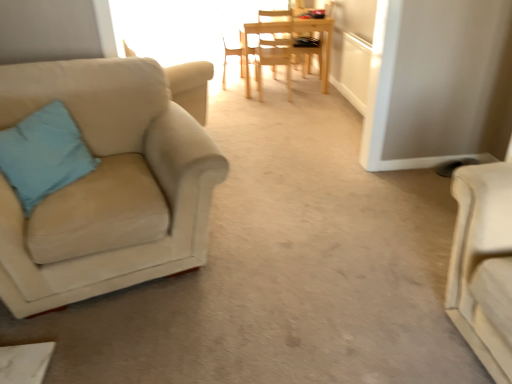
Question: Is light wood chair at center, acting as the 3th chair starting from the front, surrounded by wooden chair at center, the 1th chair in the back-to-front sequence?

Choices:
 (A) yes
 (B) no

Answer: (B)

Question: From the image's perspective, is wooden chair at center, the 1th chair in the back-to-front sequence, on top of light wood chair at center, the third chair in the back-to-front sequence?

Choices:
 (A) yes
 (B) no

Answer: (A)

Question: Is the depth of wooden chair at center, the 1th chair in the back-to-front sequence, greater than that of light wood chair at center, the third chair in the back-to-front sequence?

Choices:
 (A) no
 (B) yes

Answer: (B)

Question: Is wooden chair at center, the 5th chair viewed from the front, shorter than light wood chair at center, acting as the 3th chair starting from the front?

Choices:
 (A) yes
 (B) no

Answer: (B)

Question: Does wooden chair at center, the 5th chair viewed from the front, have a greater width compared to light wood chair at center, acting as the 3th chair starting from the front?

Choices:
 (A) no
 (B) yes

Answer: (A)

Question: Considering the positions of light wood chair at center, which is counted as the fourth chair, starting from the back, and light wood chair at center, acting as the 3th chair starting from the front, in the image, is light wood chair at center, which is counted as the fourth chair, starting from the back, wider or thinner than light wood chair at center, acting as the 3th chair starting from the front,?

Choices:
 (A) wide
 (B) thin

Answer: (B)

Question: In terms of height, does light wood chair at center, which is counted as the fourth chair, starting from the back, look taller or shorter compared to light wood chair at center, acting as the 3th chair starting from the front?

Choices:
 (A) tall
 (B) short

Answer: (A)

Question: Is light wood chair at center, the 2th chair in the front-to-back sequence, to the left or to the right of light wood chair at center, the third chair in the back-to-front sequence, in the image?

Choices:
 (A) right
 (B) left

Answer: (B)

Question: Is light wood chair at center, the 2th chair in the front-to-back sequence, bigger or smaller than light wood chair at center, acting as the 3th chair starting from the front?

Choices:
 (A) small
 (B) big

Answer: (A)

Question: From a real-world perspective, is wooden chair at center, which is the second chair in back-to-front order, physically located above or below blue fabric pillow at left?

Choices:
 (A) below
 (B) above

Answer: (A)

Question: From their relative heights in the image, would you say wooden chair at center, acting as the 4th chair starting from the front, is taller or shorter than blue fabric pillow at left?

Choices:
 (A) short
 (B) tall

Answer: (B)

Question: Would you say wooden chair at center, which is the second chair in back-to-front order, is to the left or to the right of blue fabric pillow at left in the picture?

Choices:
 (A) right
 (B) left

Answer: (A)

Question: Choose the correct answer: Is wooden chair at center, acting as the 4th chair starting from the front, inside blue fabric pillow at left or outside it?

Choices:
 (A) inside
 (B) outside

Answer: (B)

Question: From the image's perspective, relative to wooden chair at center, which is the second chair in back-to-front order, is wooden chair at center, the 1th chair in the back-to-front sequence, above or below?

Choices:
 (A) above
 (B) below

Answer: (A)

Question: In the image, is wooden chair at center, the 1th chair in the back-to-front sequence, positioned in front of or behind wooden chair at center, acting as the 4th chair starting from the front?

Choices:
 (A) front
 (B) behind

Answer: (B)